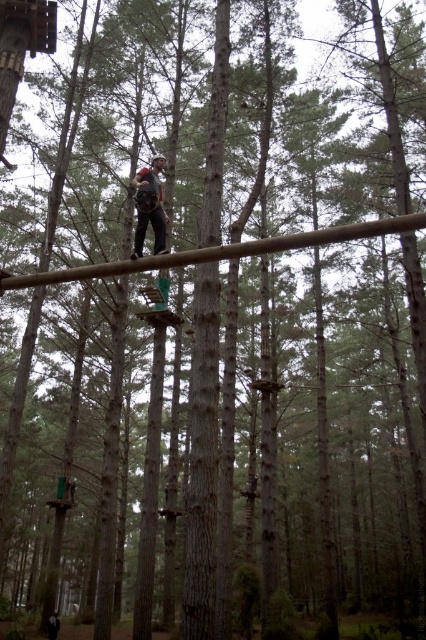
Based on the photo, can you confirm if matte gray helmet at center is positioned below dark brown leather jacket at lower left?

Actually, matte gray helmet at center is above dark brown leather jacket at lower left.

Where is `matte gray helmet at center`? Image resolution: width=426 pixels, height=640 pixels. matte gray helmet at center is located at coordinates (149, 208).

Find the location of a particular element. This screenshot has height=640, width=426. matte gray helmet at center is located at coordinates (149, 208).

This screenshot has width=426, height=640. Find the location of `matte gray helmet at center`. matte gray helmet at center is located at coordinates (149, 208).